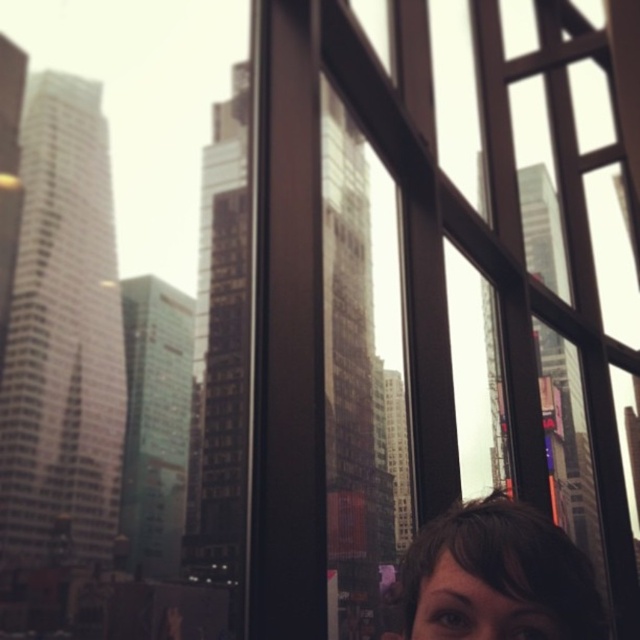
Question: Can you confirm if transparent glass window at center is bigger than brown hair at lower right?

Choices:
 (A) no
 (B) yes

Answer: (A)

Question: From the image, what is the correct spatial relationship of transparent glass window at center in relation to brown hair at lower right?

Choices:
 (A) left
 (B) right

Answer: (B)

Question: Observing the image, what is the correct spatial positioning of transparent glass window at center in reference to brown hair at lower right?

Choices:
 (A) above
 (B) below

Answer: (A)